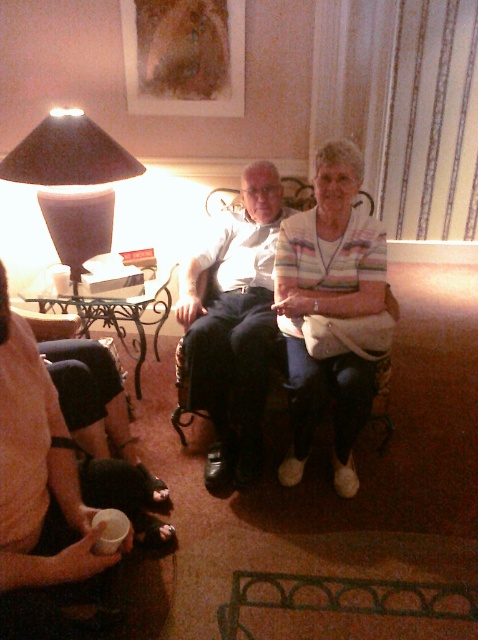
Does light brown leather chair at center have a smaller size compared to matte black lampshade at left?

No, light brown leather chair at center is not smaller than matte black lampshade at left.

Does light brown leather chair at center appear over matte black lampshade at left?

Actually, light brown leather chair at center is below matte black lampshade at left.

You are a GUI agent. You are given a task and a screenshot of the screen. Output one action in this format:
    pyautogui.click(x=<x>, y=<y>)
    Task: Click on the light brown leather chair at center
    
    Given the screenshot: What is the action you would take?
    pyautogui.click(x=234, y=324)

Does point (355, 412) come in front of point (143, 170)?

That is True.

Does white striped sweater at center appear over matte black lampshade at left?

No, white striped sweater at center is not above matte black lampshade at left.

Which is behind, point (347, 294) or point (76, 128)?

The point (76, 128) is behind.

Find the location of a particular element. white striped sweater at center is located at coordinates (330, 310).

Does white striped sweater at center have a larger size compared to light brown leather chair at center?

Actually, white striped sweater at center might be smaller than light brown leather chair at center.

Does white striped sweater at center appear on the right side of light brown leather chair at center?

Correct, you'll find white striped sweater at center to the right of light brown leather chair at center.

I want to click on white striped sweater at center, so click(x=330, y=310).